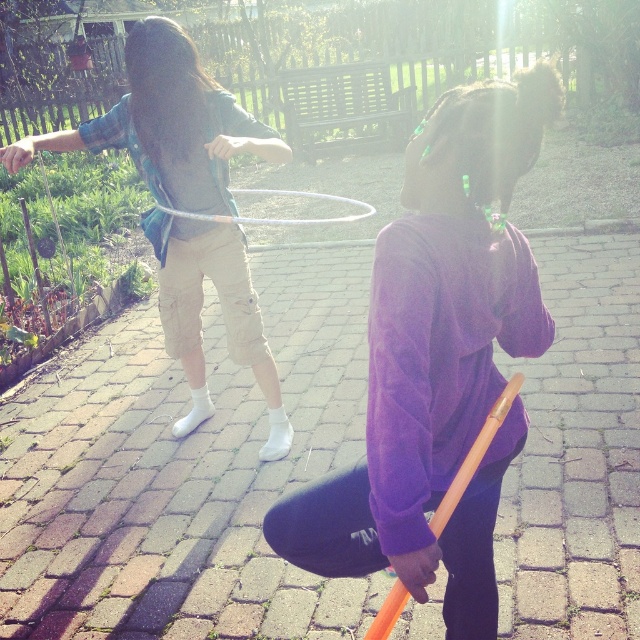
You are standing at the point labeled point [436,360] in the image. What object is located at that point?

The point [436,360] corresponds to the purple fleece sweatshirt at center.